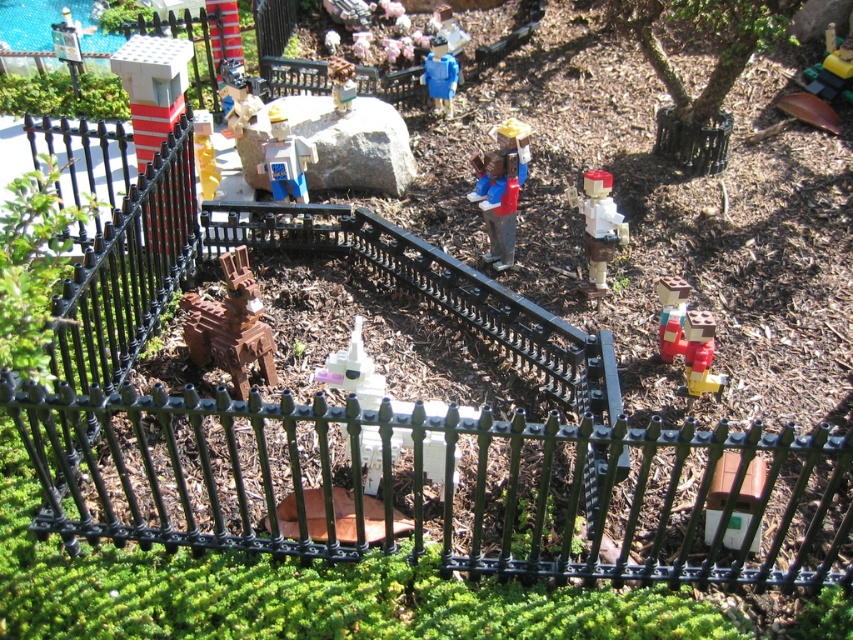
You are a visitor at a LEGO exhibition and you see the brown wooden horse at center and the white plastic unicorn at center in the miniature scene. Which one is positioned lower in the image?

The brown wooden horse at center is positioned lower than the white plastic unicorn at center in the image.

You are a visitor looking at the LEGO scene from the outside, standing at the fence. You see both the brown wooden horse at center and the smooth brown figure at center. Which one appears closer to you?

The brown wooden horse at center appears closer because it is positioned in front of the smooth brown figure at center from your viewpoint.

You are a visitor at a LEGO exhibition and see the brown wooden horse at center and the white plastic unicorn at center in the miniature scene. Which one is located to the left when viewed from your perspective?

The brown wooden horse at center is positioned on the left side of the white plastic unicorn at center, so the brown wooden horse at center is located to the left.